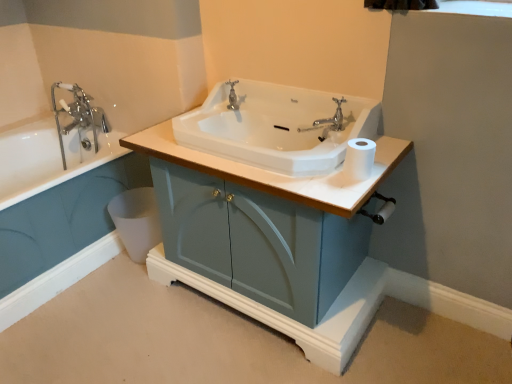
Question: Can you confirm if matte blue cabinet at center is thinner than white glossy sink at center?

Choices:
 (A) yes
 (B) no

Answer: (B)

Question: Is matte blue cabinet at center facing towards white glossy sink at center?

Choices:
 (A) yes
 (B) no

Answer: (B)

Question: Can you confirm if matte blue cabinet at center is smaller than white glossy sink at center?

Choices:
 (A) no
 (B) yes

Answer: (A)

Question: From the image's perspective, is matte blue cabinet at center below white glossy sink at center?

Choices:
 (A) yes
 (B) no

Answer: (A)

Question: Is matte blue cabinet at center not near white glossy sink at center?

Choices:
 (A) no
 (B) yes

Answer: (A)

Question: From their relative heights in the image, would you say white plastic toilet bowl at lower left is taller or shorter than white matte toilet paper at right?

Choices:
 (A) short
 (B) tall

Answer: (B)

Question: From a real-world perspective, relative to white matte toilet paper at right, is white plastic toilet bowl at lower left vertically above or below?

Choices:
 (A) above
 (B) below

Answer: (B)

Question: Considering the relative positions of white plastic toilet bowl at lower left and white matte toilet paper at right in the image provided, is white plastic toilet bowl at lower left to the left or to the right of white matte toilet paper at right?

Choices:
 (A) left
 (B) right

Answer: (A)

Question: Is white plastic toilet bowl at lower left wider or thinner than white matte toilet paper at right?

Choices:
 (A) wide
 (B) thin

Answer: (A)

Question: Is white matte toilet paper at right spatially inside white plastic toilet bowl at lower left, or outside of it?

Choices:
 (A) inside
 (B) outside

Answer: (B)

Question: From the image's perspective, is white matte toilet paper at right above or below white plastic toilet bowl at lower left?

Choices:
 (A) above
 (B) below

Answer: (A)

Question: In the image, is white matte toilet paper at right on the left side or the right side of white plastic toilet bowl at lower left?

Choices:
 (A) right
 (B) left

Answer: (A)

Question: In terms of width, does white matte toilet paper at right look wider or thinner when compared to white plastic toilet bowl at lower left?

Choices:
 (A) thin
 (B) wide

Answer: (A)

Question: Would you say matte blue cabinet at center is to the left or to the right of polished chrome faucet at center in the picture?

Choices:
 (A) right
 (B) left

Answer: (A)

Question: Is matte blue cabinet at center bigger or smaller than polished chrome faucet at center?

Choices:
 (A) big
 (B) small

Answer: (A)